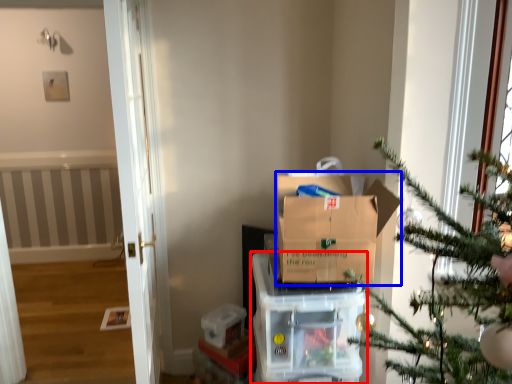
Question: Among these objects, which one is nearest to the camera, appliance (highlighted by a red box) or cardboard box (highlighted by a blue box)?

Choices:
 (A) appliance
 (B) cardboard box

Answer: (B)